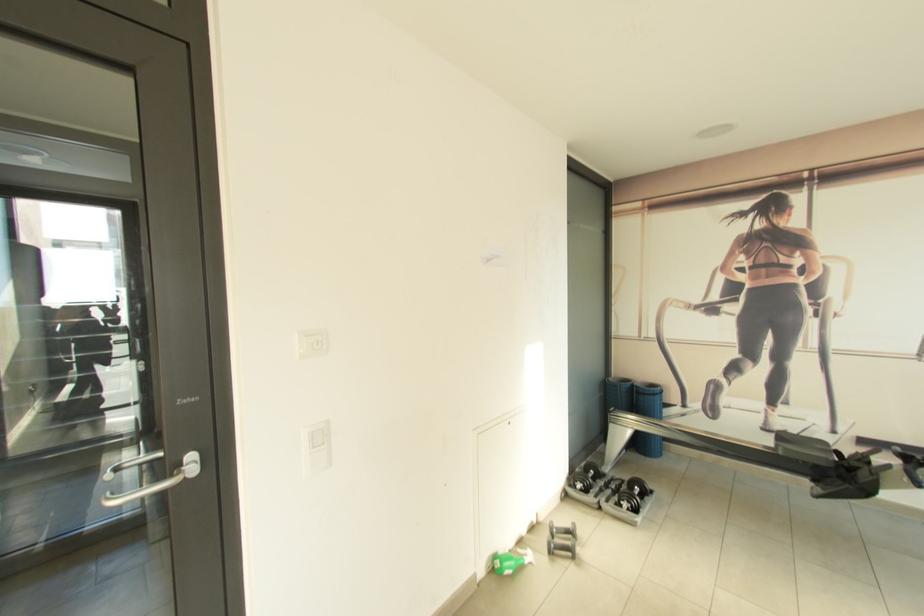
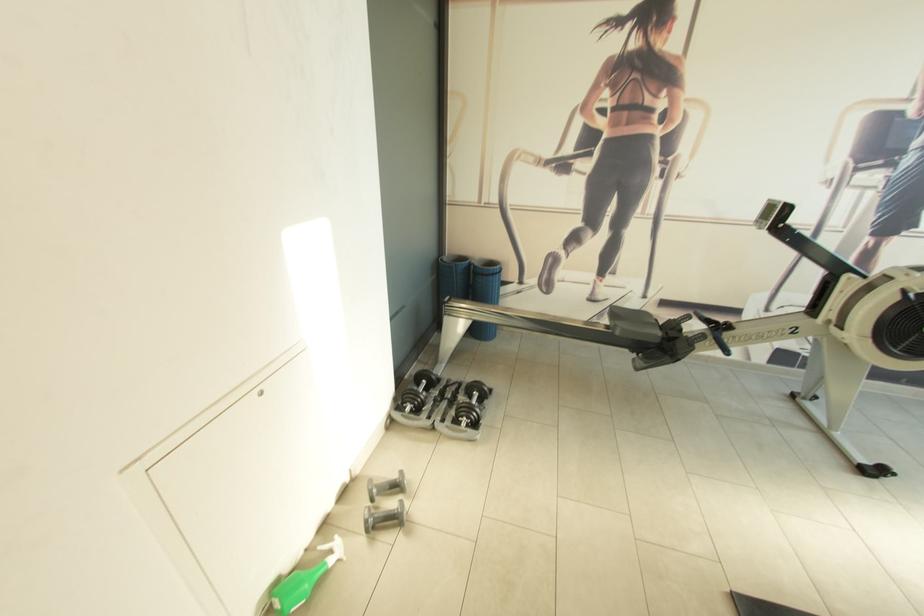
Where in the second image is the point corresponding to point (532, 556) from the first image?

(339, 551)